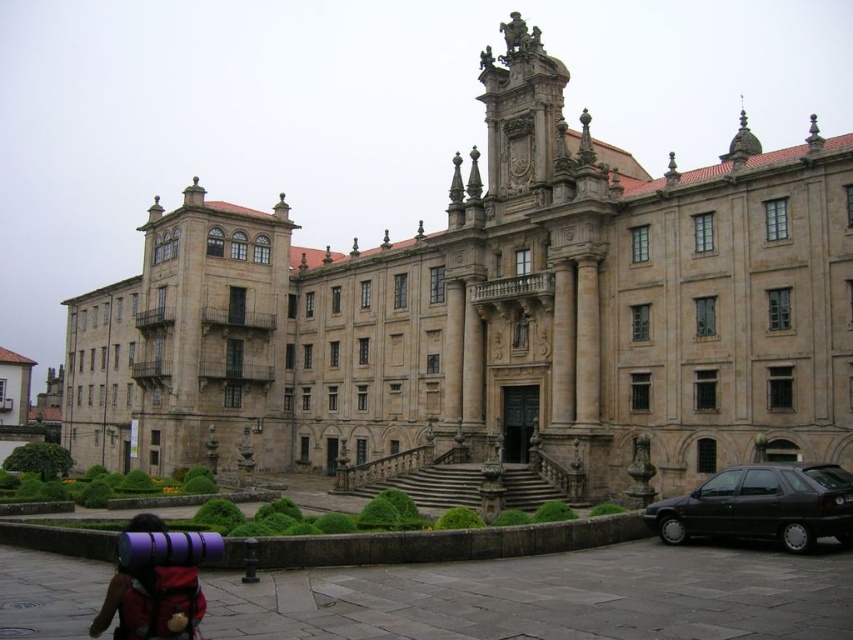
You are standing at the entrance of the grand historical building and want to locate both the black matte hatchback at lower right and the purple fabric backpack at lower left. From your perspective at the entrance, which object is positioned further to the right?

The black matte hatchback at lower right is positioned further to the right compared to the purple fabric backpack at lower left.

You are standing at the center of the image and want to locate the black matte hatchback at lower right. In which direction should you look relative to your current position?

You should look to the lower right direction from your current position at the center of the image to locate the black matte hatchback at lower right.

You are standing in front of the grand historical building and want to determine which of the two points, point (x=289, y=412) or point (x=155, y=624), is closer to you. Based on the building layout described, which point is nearer?

Point (x=289, y=412) is closer to the viewer than point (x=155, y=624) because it is further to the viewer according to the description.